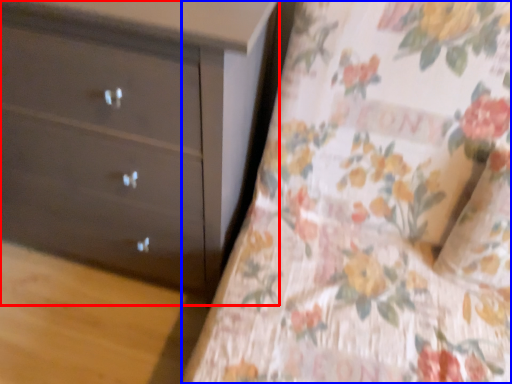
Question: Which point is closer to the camera, chest of drawers (highlighted by a red box) or sheet (highlighted by a blue box)?

Choices:
 (A) chest of drawers
 (B) sheet

Answer: (B)